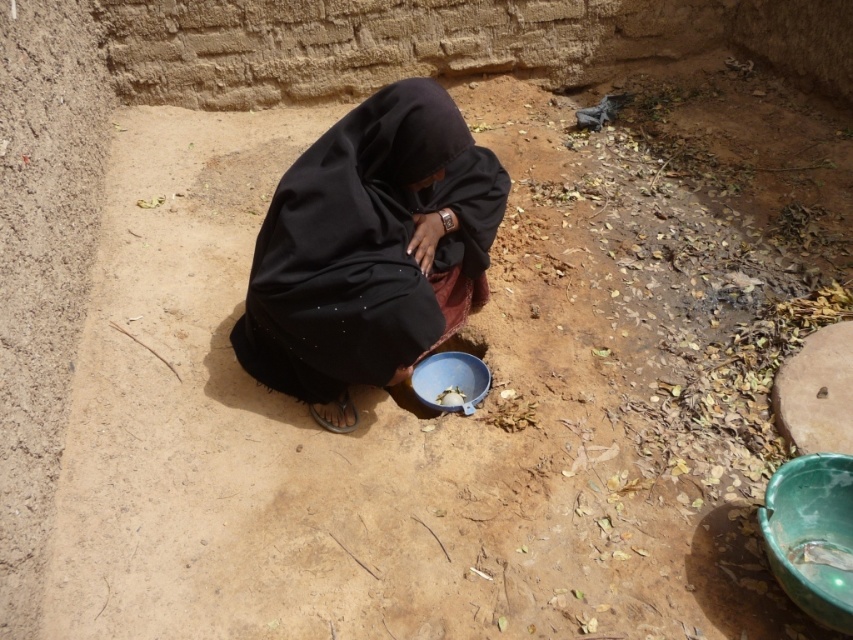
From the picture: You are a photographer trying to capture the blue plastic bowl at center and the green glossy bowl at lower right in your shot. If you want to focus on the bowl that is farther away, which one should you aim your camera at?

You should aim your camera at the blue plastic bowl at center because it is farther away from the viewer compared to the green glossy bowl at lower right.

You are a delivery person who needs to place a small package between the black matte dress at center and the blue plastic bowl at center. Given that the minimum required distance for placing the package is 20 inches, can you safely place it there?

The black matte dress at center is 18.92 inches away from the blue plastic bowl at center, which is less than the required 20 inches. Therefore, you cannot safely place the package between them.